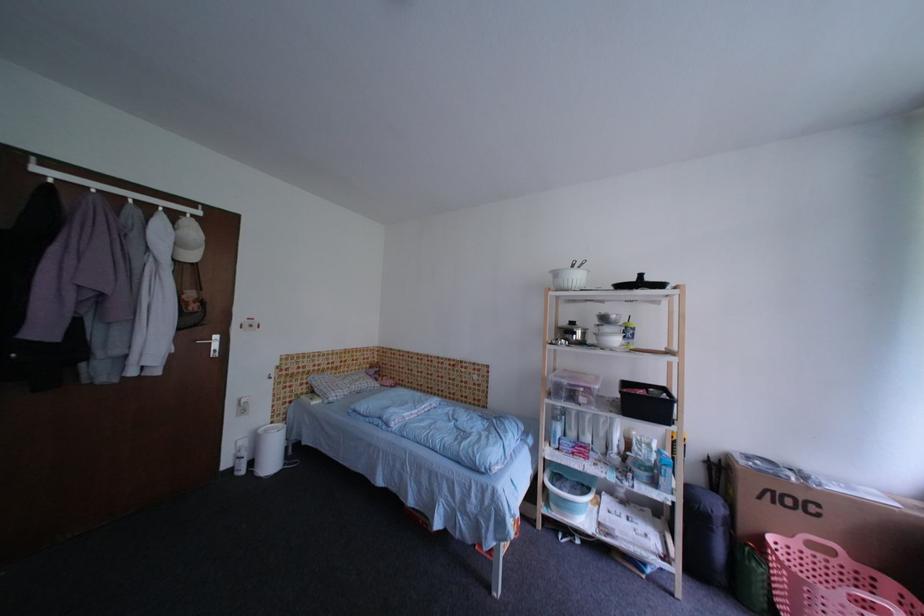
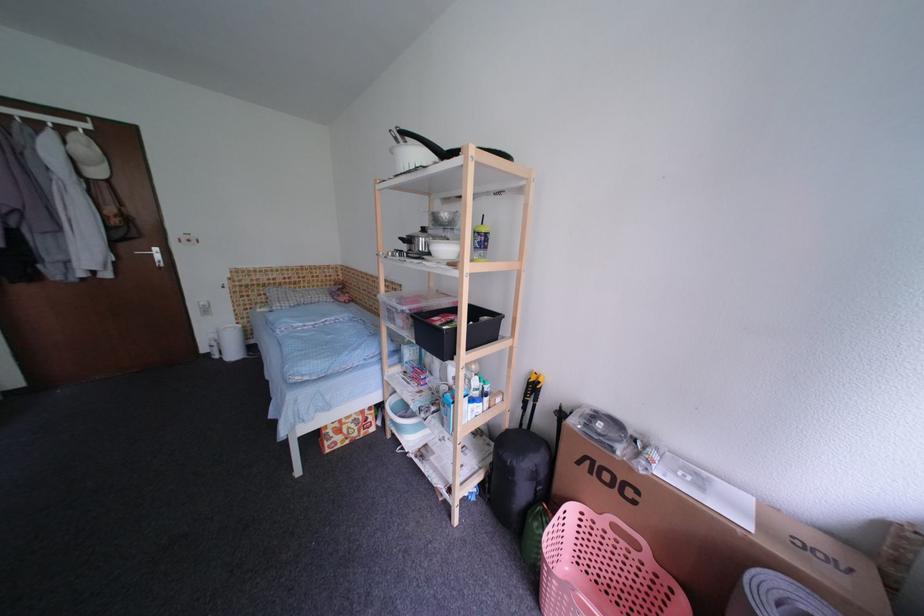
The point at [622,318] is marked in the first image. Where is the corresponding point in the second image?

(453, 217)